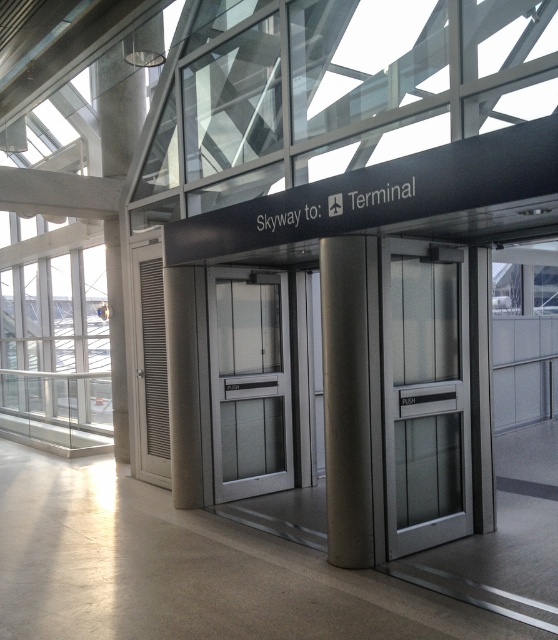
You are a maintenance worker needing to access the service panel located behind the satin silver elevator at center and the frosted glass door at center. Which object should you move first to reach the panel?

You should move the satin silver elevator at center first because it occupies less space than the frosted glass door at center, making it easier to access the service panel behind it.

You are a traveler who just arrived at the airport and wants to reach the Skyway to Terminal elevators. You see the frosted glass door at center and the satin silver column at center. Which object is closer to you as you approach the elevators?

The frosted glass door at center is closer to you because the satin silver column at center is behind it.

You are navigating an airport terminal and see two points marked on the floor. The first point is labeled as point (387, 300) and the second as point (367, 364). If you are facing the direction of the Skyway to Terminal elevators, which point is closer to the elevators?

Point (367, 364) is closer to the elevators because it is in front of point (387, 300) when facing the Skyway to Terminal elevators.